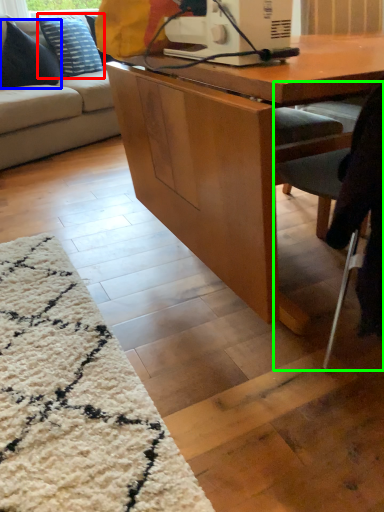
Question: Which object is positioned farthest from pillow (highlighted by a red box)? Select from pillow (highlighted by a blue box) and chair (highlighted by a green box).

Choices:
 (A) pillow
 (B) chair

Answer: (B)